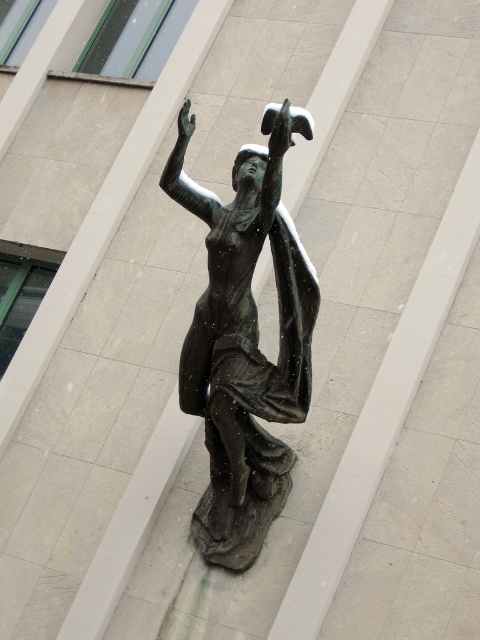
You are standing at the entrance of the building and want to locate the bronze statue at center. According to the coordinates provided, where should you look to find it?

The bronze statue at center is located at coordinates point [245,344], so you should look towards the center of the image to find it.